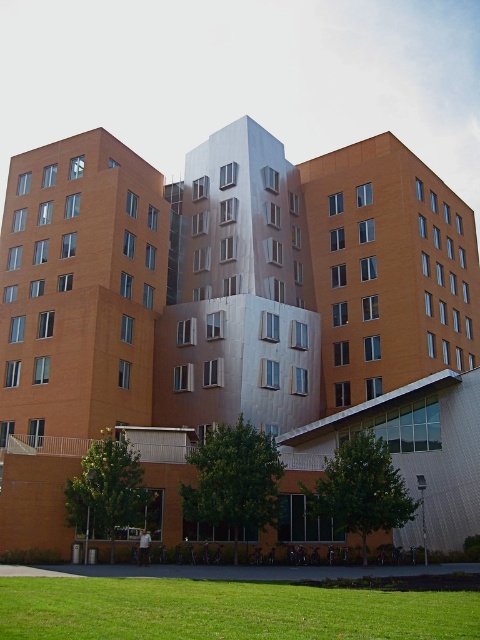
Who is taller, matte orange building at center or green grass at lower center?

Standing taller between the two is matte orange building at center.

Does matte orange building at center have a greater height compared to green grass at lower center?

Correct, matte orange building at center is much taller as green grass at lower center.

Does point (64, 209) lie behind point (164, 600)?

Yes.

The image size is (480, 640). What are the coordinates of `matte orange building at center` in the screenshot? It's located at [x=235, y=321].